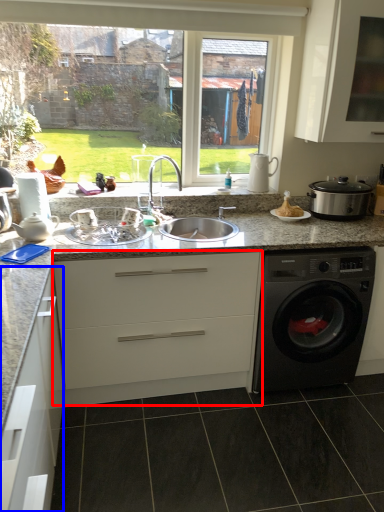
Question: Which object appears closest to the camera in this image, cabinetry (highlighted by a red box) or cabinetry (highlighted by a blue box)?

Choices:
 (A) cabinetry
 (B) cabinetry

Answer: (B)